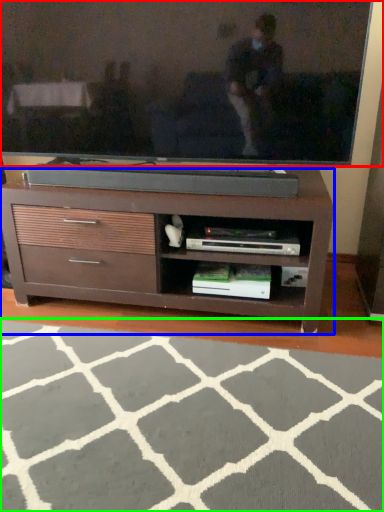
Question: Which object is positioned closest to television (highlighted by a red box)? Select from chest of drawers (highlighted by a blue box) and plain (highlighted by a green box).

Choices:
 (A) chest of drawers
 (B) plain

Answer: (A)